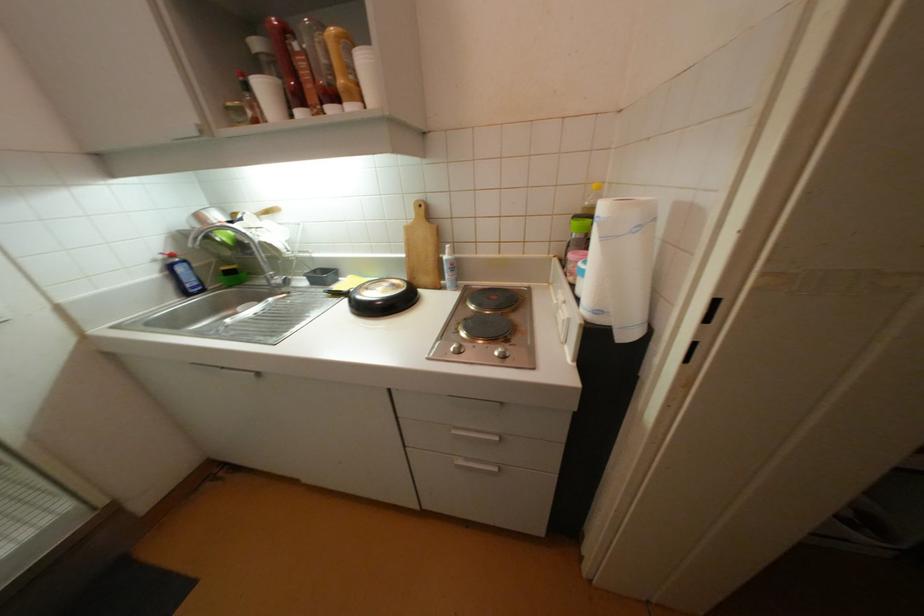
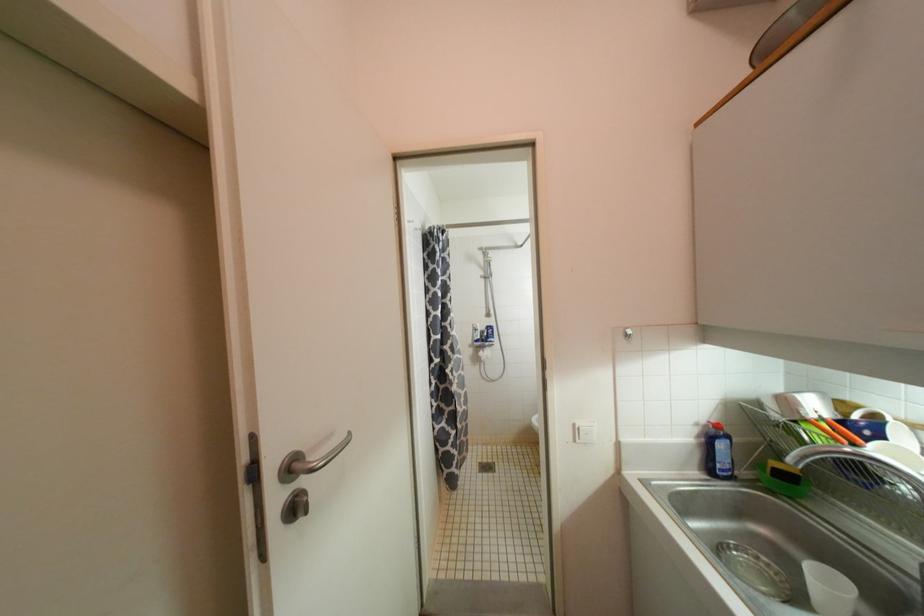
Question: The camera is either moving clockwise (left) or counter-clockwise (right) around the object. The first image is from the beginning of the video and the second image is from the end. Is the camera moving left or right when shooting the video?

Choices:
 (A) Left
 (B) Right

Answer: (B)